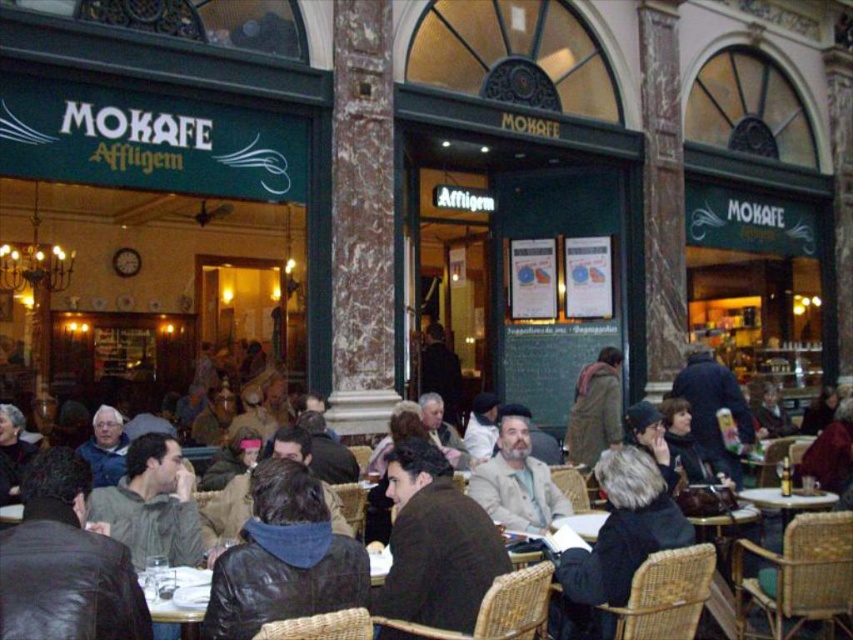
You are a customer at MOKAFE Affligem and want to hang your coat on the coat rack near the entrance. The coat rack has a height limit of 1 meter. Which of your coats, the dark brown leather jacket at center or the brown wool coat at center, is more likely to exceed the height limit?

The dark brown leather jacket at center is taller than the brown wool coat at center. Since the coat rack has a height limit of 1 meter, the dark brown leather jacket at center is more likely to exceed the height limit.